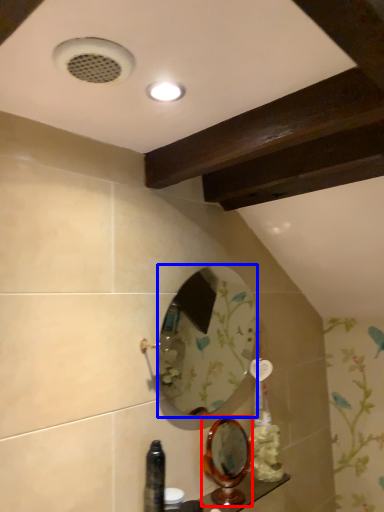
Question: Which of the following is the closest to the observer, mirror (highlighted by a red box) or mirror (highlighted by a blue box)?

Choices:
 (A) mirror
 (B) mirror

Answer: (B)